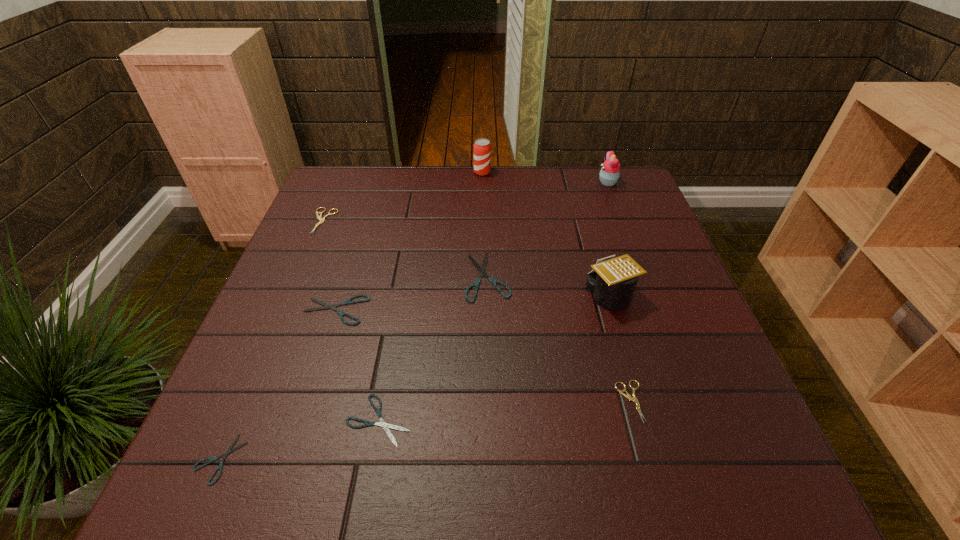
This screenshot has height=540, width=960. Identify the location of object identified as the second closest to the fifth shears from left to right. (347, 302).

Where is `the second closest object to the calculator`? the second closest object to the calculator is located at coordinates (628, 396).

You are a GUI agent. You are given a task and a screenshot of the screen. Output one action in this format:
    pyautogui.click(x=<x>, y=<y>)
    Task: Click on the shears that can be found as the closest to the farther beige shears
    The height and width of the screenshot is (540, 960).
    Given the screenshot: What is the action you would take?
    pyautogui.click(x=347, y=302)

Where is `shears that is the third nearest to the farther beige shears`? This screenshot has width=960, height=540. shears that is the third nearest to the farther beige shears is located at coordinates (385, 426).

I want to click on black shears that is the third closest to the cupcake, so click(385, 426).

Identify which black shears is the closest to the farther beige shears. Please provide its 2D coordinates. Your answer should be formatted as a tuple, i.e. [(x, y)], where the tuple contains the x and y coordinates of a point satisfying the conditions above.

[(347, 302)]

You are a GUI agent. You are given a task and a screenshot of the screen. Output one action in this format:
    pyautogui.click(x=<x>, y=<y>)
    Task: Click on the free space that satisfies the following two spatial constraints: 1. on the front side of the fourth shears from right to left; 2. on the left side of the third shears from right to left
    
    Given the screenshot: What is the action you would take?
    pyautogui.click(x=301, y=420)

Find the location of a particular element. Image resolution: width=960 pixels, height=540 pixels. blank space that satisfies the following two spatial constraints: 1. on the face of the rightmost object; 2. on the front side of the third shears from left to right is located at coordinates (657, 310).